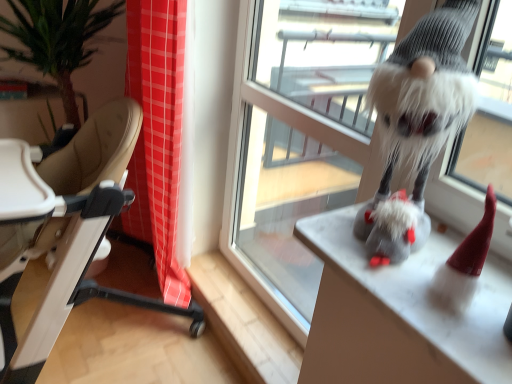
Question: From the image's perspective, is transparent glass window at center under fuzzy gray gnome at upper right?

Choices:
 (A) no
 (B) yes

Answer: (B)

Question: Is transparent glass window at center aimed at fuzzy gray gnome at upper right?

Choices:
 (A) no
 (B) yes

Answer: (A)

Question: Are transparent glass window at center and fuzzy gray gnome at upper right far apart?

Choices:
 (A) yes
 (B) no

Answer: (B)

Question: Does transparent glass window at center have a larger size compared to fuzzy gray gnome at upper right?

Choices:
 (A) no
 (B) yes

Answer: (B)

Question: Does transparent glass window at center lie behind fuzzy gray gnome at upper right?

Choices:
 (A) yes
 (B) no

Answer: (A)

Question: Is transparent glass window at center outside fuzzy gray gnome at upper right?

Choices:
 (A) yes
 (B) no

Answer: (A)

Question: Is transparent glass window at center taller than beige leather highchair at left?

Choices:
 (A) yes
 (B) no

Answer: (A)

Question: Is transparent glass window at center not near beige leather highchair at left?

Choices:
 (A) no
 (B) yes

Answer: (A)

Question: Is transparent glass window at center looking in the opposite direction of beige leather highchair at left?

Choices:
 (A) no
 (B) yes

Answer: (A)

Question: From the image's perspective, is transparent glass window at center over beige leather highchair at left?

Choices:
 (A) yes
 (B) no

Answer: (A)

Question: From a real-world perspective, is transparent glass window at center over beige leather highchair at left?

Choices:
 (A) no
 (B) yes

Answer: (B)

Question: Considering the relative positions of transparent glass window at center and beige leather highchair at left in the image provided, is transparent glass window at center in front of beige leather highchair at left?

Choices:
 (A) yes
 (B) no

Answer: (A)

Question: From a real-world perspective, does fuzzy gray gnome at right sit lower than transparent glass window at center?

Choices:
 (A) yes
 (B) no

Answer: (B)